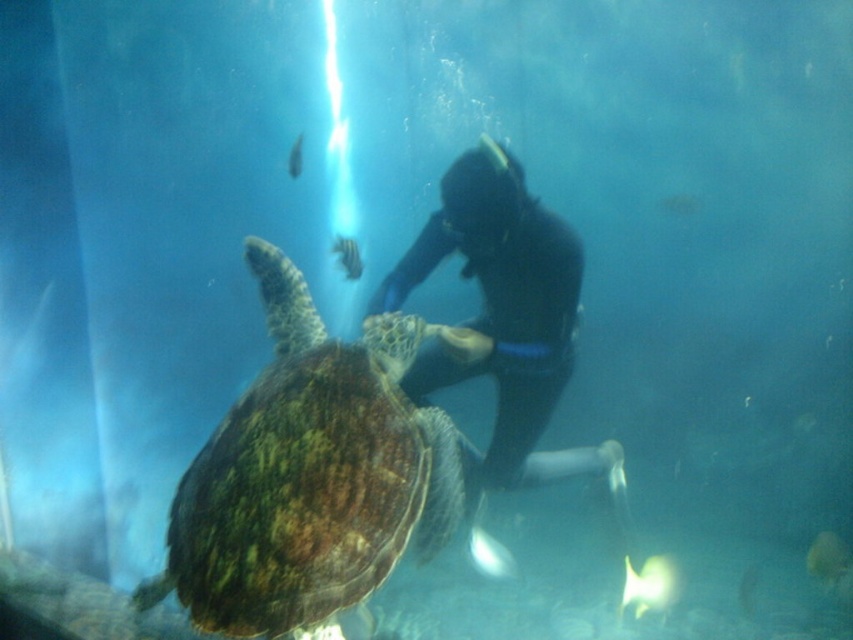
Is black rubber suit at center further to the viewer compared to translucent greenish-blue fish at center?

No, it is not.

Between black rubber suit at center and translucent greenish-blue fish at center, which one has more height?

black rubber suit at center is taller.

Describe the element at coordinates (503, 317) in the screenshot. I see `black rubber suit at center` at that location.

The image size is (853, 640). Identify the location of black rubber suit at center. (503, 317).

From the picture: Can you confirm if green textured shell at center is smaller than shiny blue fish at center?

No, green textured shell at center is not smaller than shiny blue fish at center.

In the scene shown: Is green textured shell at center taller than shiny blue fish at center?

Indeed, green textured shell at center has a greater height compared to shiny blue fish at center.

Is point (209, 468) in front of point (345, 276)?

Yes, point (209, 468) is in front of point (345, 276).

At what (x,y) coordinates should I click in order to perform the action: click on green textured shell at center. Please return your answer as a coordinate pair (x, y). This screenshot has width=853, height=640. Looking at the image, I should click on (309, 474).

Does shiny blue fish at center appear on the left side of translucent greenish-blue fish at center?

In fact, shiny blue fish at center is to the right of translucent greenish-blue fish at center.

Which is behind, point (352, 252) or point (297, 152)?

The point (352, 252) is more distant.

Locate an element on the screen. shiny blue fish at center is located at coordinates (347, 257).